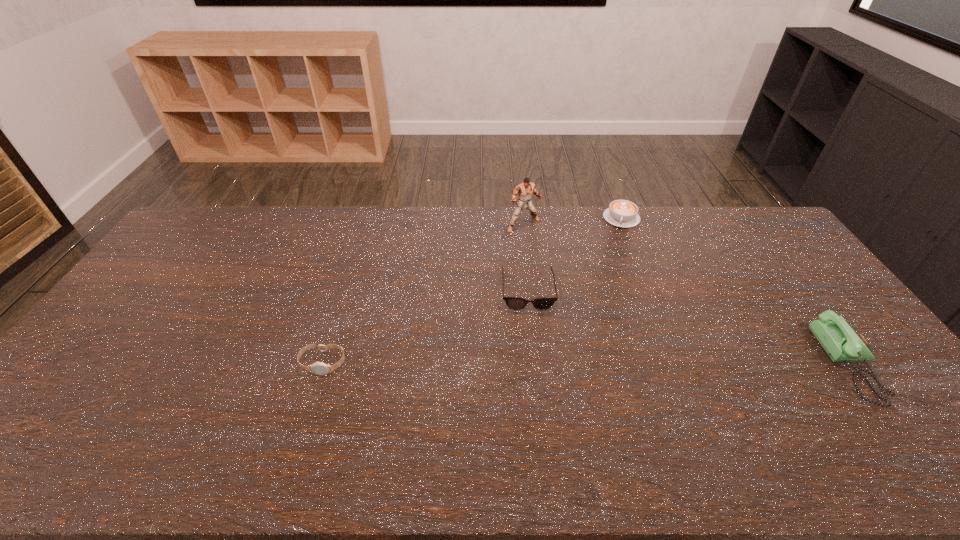
Identify the location of free spot on the desktop that is between the watch and the telephone and is positioned on the front-facing side of the tallest object. (636, 364).

You are a GUI agent. You are given a task and a screenshot of the screen. Output one action in this format:
    pyautogui.click(x=<x>, y=<y>)
    Task: Click on the vacant space on the desktop that is between the leftmost object and the rightmost object and is positioned on the front lenses of the sunglasses
    The height and width of the screenshot is (540, 960).
    Given the screenshot: What is the action you would take?
    pyautogui.click(x=533, y=364)

You are a GUI agent. You are given a task and a screenshot of the screen. Output one action in this format:
    pyautogui.click(x=<x>, y=<y>)
    Task: Click on the free space on the desktop that is between the leftmost object and the telephone and is positioned on the side of the second object from right to left with the handle
    Image resolution: width=960 pixels, height=540 pixels.
    Given the screenshot: What is the action you would take?
    pyautogui.click(x=594, y=364)